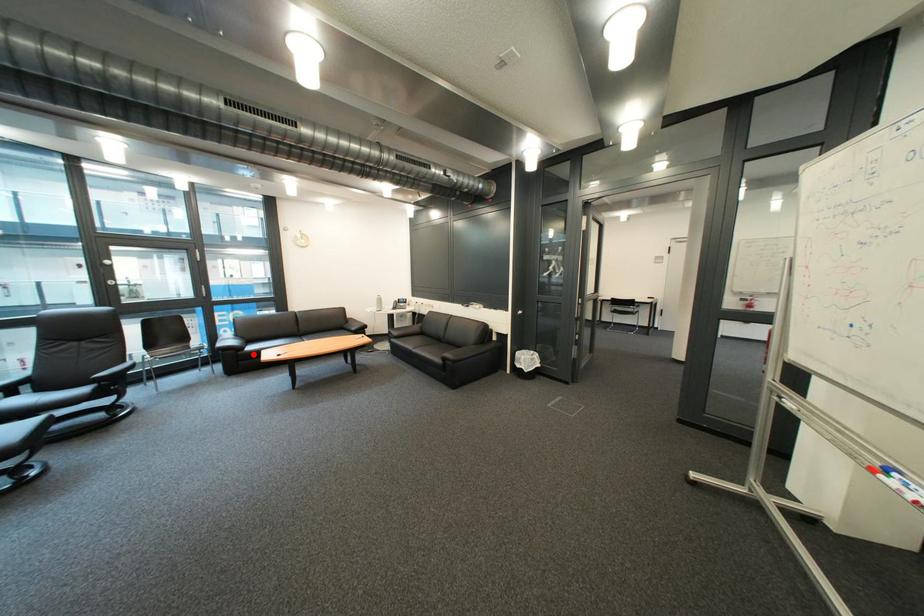
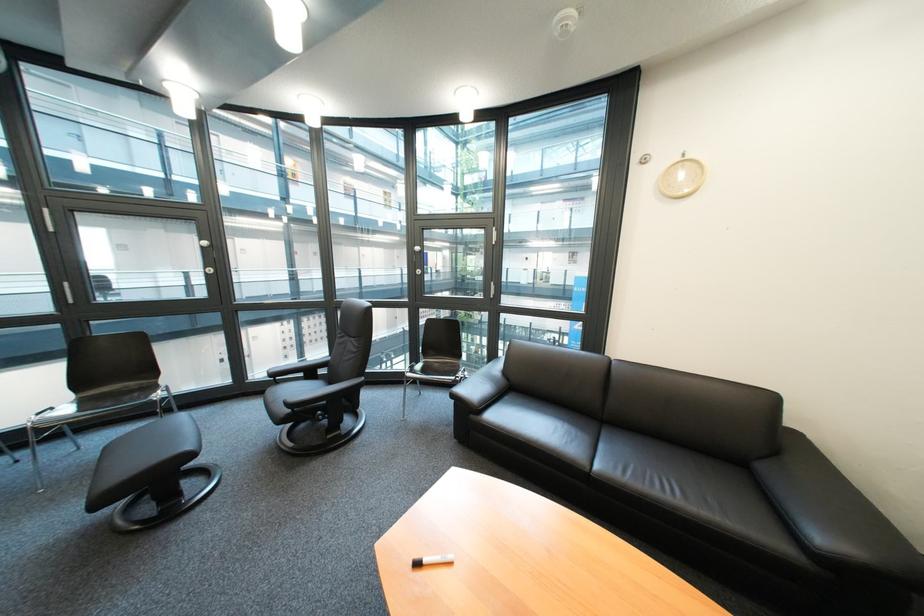
In the second image, find the point that corresponds to the highlighted location in the first image.

(485, 418)